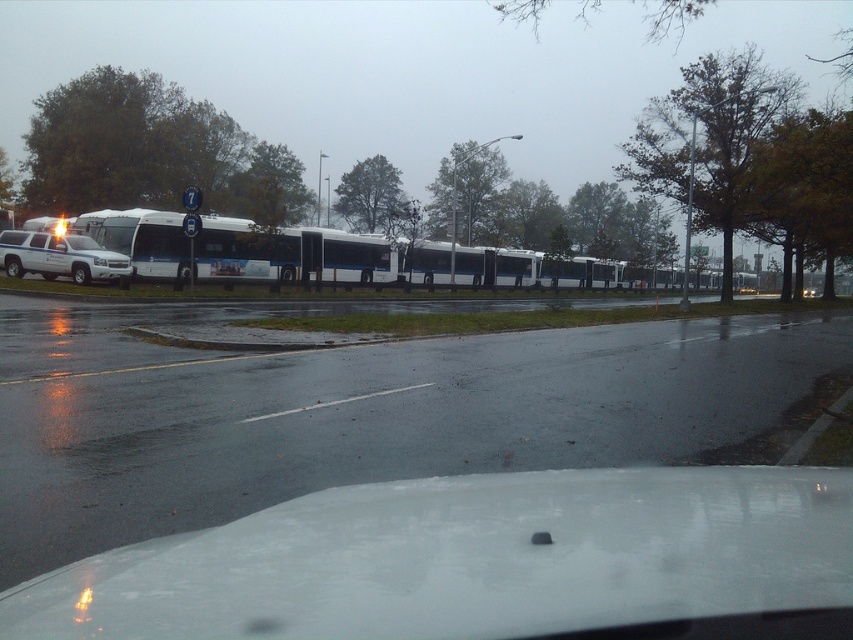
Question: Which point is farther from the camera taking this photo?

Choices:
 (A) (766, 490)
 (B) (337, 404)

Answer: (B)

Question: Which object is positioned closest to the white glossy line at center?

Choices:
 (A) white glossy car at lower center
 (B) white matte truck at left

Answer: (A)

Question: Which point is farther to the camera?

Choices:
 (A) (364, 394)
 (B) (122, 253)

Answer: (B)

Question: Is white matte truck at left above white glossy line at center?

Choices:
 (A) yes
 (B) no

Answer: (A)

Question: Can you confirm if white glossy car at lower center is smaller than white glossy line at center?

Choices:
 (A) no
 (B) yes

Answer: (A)

Question: Does white glossy car at lower center have a larger size compared to white matte truck at left?

Choices:
 (A) yes
 (B) no

Answer: (B)